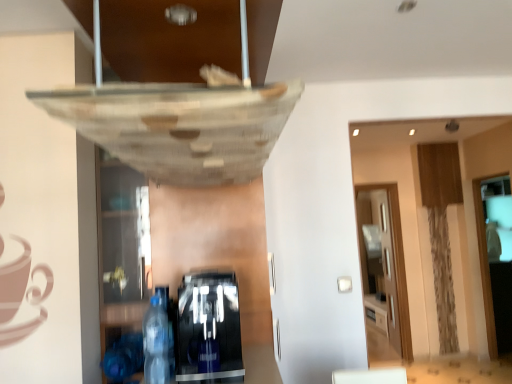
Question: From a real-world perspective, is transparent wood glass door at right, placed as the second glass door when sorted from right to left, positioned under black glossy coffee machine at lower center, the first shelf when ordered from right to left, based on gravity?

Choices:
 (A) yes
 (B) no

Answer: (A)

Question: Are transparent wood glass door at right, the first glass door viewed from the back, and black glossy coffee machine at lower center, the second shelf in the left-to-right sequence, located far from each other?

Choices:
 (A) no
 (B) yes

Answer: (B)

Question: Does transparent wood glass door at right, which is counted as the 1th glass door, starting from the left, turn towards black glossy coffee machine at lower center, the first shelf when ordered from right to left?

Choices:
 (A) no
 (B) yes

Answer: (A)

Question: Does transparent wood glass door at right, placed as the second glass door when sorted from right to left, have a smaller size compared to black glossy coffee machine at lower center, the first shelf when ordered from right to left?

Choices:
 (A) no
 (B) yes

Answer: (B)

Question: Does transparent wood glass door at right, the first glass door viewed from the back, appear on the left side of black glossy coffee machine at lower center, the first shelf when ordered from right to left?

Choices:
 (A) yes
 (B) no

Answer: (B)

Question: In terms of size, does transparent glass door at right, which is the first glass door from front to back, appear bigger or smaller than black glossy coffee machine at lower center, the second shelf in the left-to-right sequence?

Choices:
 (A) big
 (B) small

Answer: (B)

Question: Visually, is transparent glass door at right, acting as the 2th glass door starting from the back, positioned to the left or to the right of black glossy coffee machine at lower center, the first shelf when ordered from right to left?

Choices:
 (A) right
 (B) left

Answer: (A)

Question: In terms of height, does transparent glass door at right, which is the first glass door from front to back, look taller or shorter compared to black glossy coffee machine at lower center, the first shelf when ordered from right to left?

Choices:
 (A) short
 (B) tall

Answer: (B)

Question: From a real-world perspective, is transparent glass door at right, the first glass door when ordered from right to left, physically located above or below black glossy coffee machine at lower center, the first shelf when ordered from right to left?

Choices:
 (A) above
 (B) below

Answer: (B)

Question: From the image's perspective, is transparent glass door at right, the first glass door when ordered from right to left, positioned above or below transparent glass shelf at lower left, which is the second shelf in right-to-left order?

Choices:
 (A) below
 (B) above

Answer: (A)

Question: Is transparent glass door at right, which is the first glass door from front to back, bigger or smaller than transparent glass shelf at lower left, which is the 1th shelf in left-to-right order?

Choices:
 (A) big
 (B) small

Answer: (A)

Question: From a real-world perspective, is transparent glass door at right, the first glass door when ordered from right to left, physically located above or below transparent glass shelf at lower left, which is the second shelf in right-to-left order?

Choices:
 (A) above
 (B) below

Answer: (B)

Question: From their relative heights in the image, would you say transparent glass door at right, acting as the 2th glass door starting from the back, is taller or shorter than transparent glass shelf at lower left, which is the second shelf in right-to-left order?

Choices:
 (A) tall
 (B) short

Answer: (A)

Question: Do you think black glossy coffee machine at lower center, the second shelf in the left-to-right sequence, is within transparent glass door at right, acting as the 2th glass door starting from the back, or outside of it?

Choices:
 (A) inside
 (B) outside

Answer: (B)

Question: In terms of width, does black glossy coffee machine at lower center, the first shelf when ordered from right to left, look wider or thinner when compared to transparent glass door at right, the first glass door when ordered from right to left?

Choices:
 (A) wide
 (B) thin

Answer: (A)